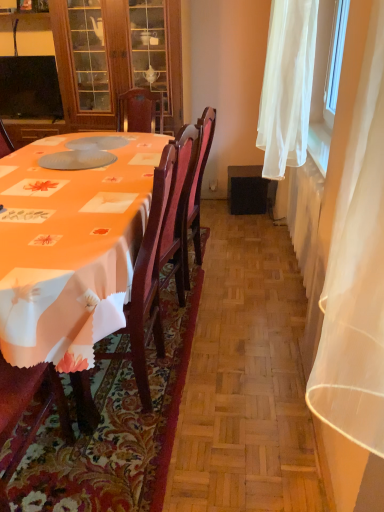
Question: Can you confirm if wooden chair at left is bigger than black glossy television at upper left?

Choices:
 (A) yes
 (B) no

Answer: (A)

Question: Is wooden chair at left wider than black glossy television at upper left?

Choices:
 (A) no
 (B) yes

Answer: (B)

Question: Is wooden chair at left at the left side of black glossy television at upper left?

Choices:
 (A) no
 (B) yes

Answer: (A)

Question: From a real-world perspective, is wooden chair at left located higher than black glossy television at upper left?

Choices:
 (A) no
 (B) yes

Answer: (A)

Question: From the image's perspective, is wooden chair at left located beneath black glossy television at upper left?

Choices:
 (A) no
 (B) yes

Answer: (B)

Question: Can you confirm if wooden chair at left is positioned to the right of black glossy television at upper left?

Choices:
 (A) yes
 (B) no

Answer: (A)

Question: Could you tell me if matte wood cabinet at upper left is facing wooden chair at left?

Choices:
 (A) yes
 (B) no

Answer: (A)

Question: From a real-world perspective, is matte wood cabinet at upper left on top of wooden chair at left?

Choices:
 (A) yes
 (B) no

Answer: (A)

Question: Is matte wood cabinet at upper left facing away from wooden chair at left?

Choices:
 (A) yes
 (B) no

Answer: (B)

Question: From the image's perspective, is matte wood cabinet at upper left located above wooden chair at left?

Choices:
 (A) no
 (B) yes

Answer: (B)

Question: From a real-world perspective, is matte wood cabinet at upper left below wooden chair at left?

Choices:
 (A) no
 (B) yes

Answer: (A)

Question: From the image's perspective, is matte wood cabinet at upper left under wooden chair at left?

Choices:
 (A) no
 (B) yes

Answer: (A)

Question: Is white sheer curtain at right inside black glossy television at upper left?

Choices:
 (A) yes
 (B) no

Answer: (B)